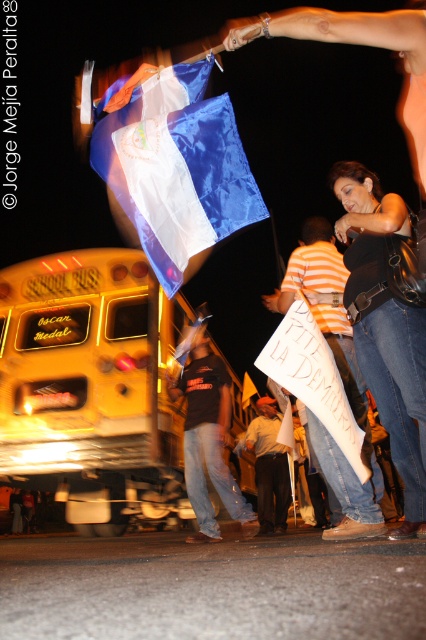
Does yellow matte school bus at lower left appear on the right side of dark blue jeans at center?

Incorrect, yellow matte school bus at lower left is not on the right side of dark blue jeans at center.

From the picture: Measure the distance between point (25, 401) and camera.

Point (25, 401) and camera are 7.10 meters apart.

The width and height of the screenshot is (426, 640). What are the coordinates of `yellow matte school bus at lower left` in the screenshot? It's located at (92, 388).

The image size is (426, 640). Describe the element at coordinates (92, 388) in the screenshot. I see `yellow matte school bus at lower left` at that location.

Is point (166, 394) in front of point (152, 141)?

That is False.

Is point (114, 378) positioned in front of point (213, 140)?

No.

Image resolution: width=426 pixels, height=640 pixels. Find the location of `yellow matte school bus at lower left`. yellow matte school bus at lower left is located at coordinates click(x=92, y=388).

Is shiny blue and white flag at upper center to the right of black matte shirt at center from the viewer's perspective?

Incorrect, shiny blue and white flag at upper center is not on the right side of black matte shirt at center.

Who is more forward, (196, 252) or (195, 355)?

Point (196, 252) is more forward.

Is point (198, 232) farther from camera compared to point (209, 364)?

No.

Locate an element on the screen. This screenshot has height=640, width=426. shiny blue and white flag at upper center is located at coordinates (176, 168).